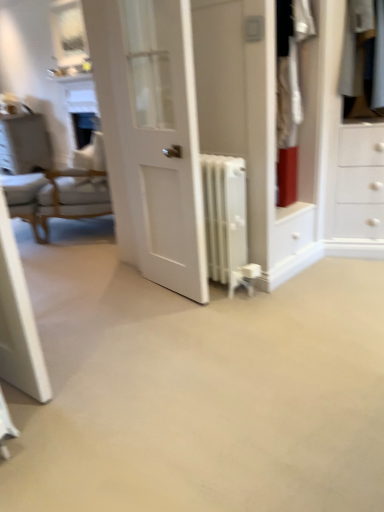
Identify the location of free space in front of white metallic radiator at center. This screenshot has width=384, height=512. (229, 313).